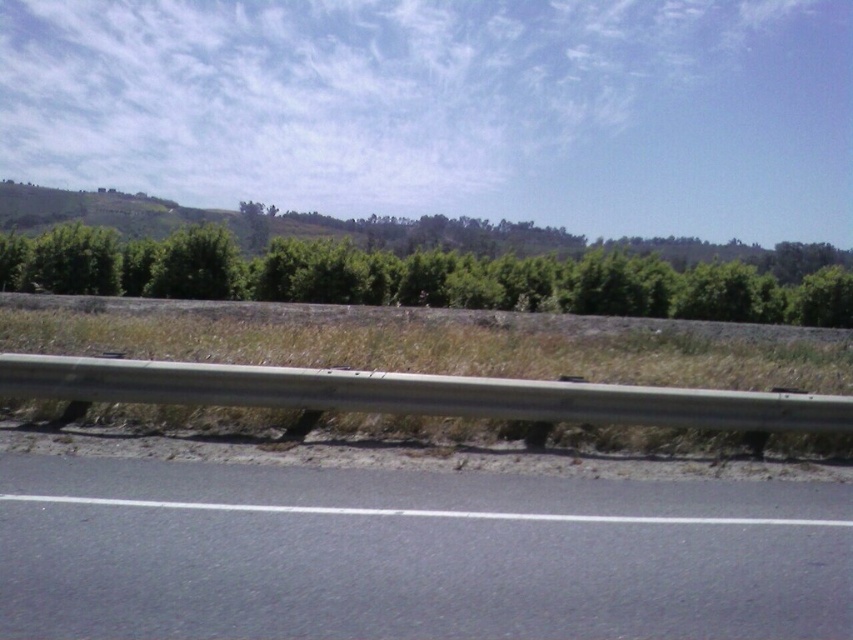
You are a delivery driver planning to make a U turn on the black asphalt road at lower center. You need to know if there is enough space between the road and the green leafy trees at center to safely complete the maneuver. Can you confirm if the road is wider than the trees?

The black asphalt road at lower center has a lesser width compared to green leafy trees at center, so the road is not wide enough for a safe U turn maneuver between them.

In the scene shown: You are driving a car and see the black asphalt road at lower center and the green leafy trees at center. Which object is closer to the left side of the road?

The black asphalt road at lower center is to the left of green leafy trees at center, so the black asphalt road at lower center is closer to the left side of the road.

You are standing at point (x=412, y=554). What is the color of the surface you are currently standing on?

The surface at point (x=412, y=554) is black asphalt road at lower center, so the color is black.